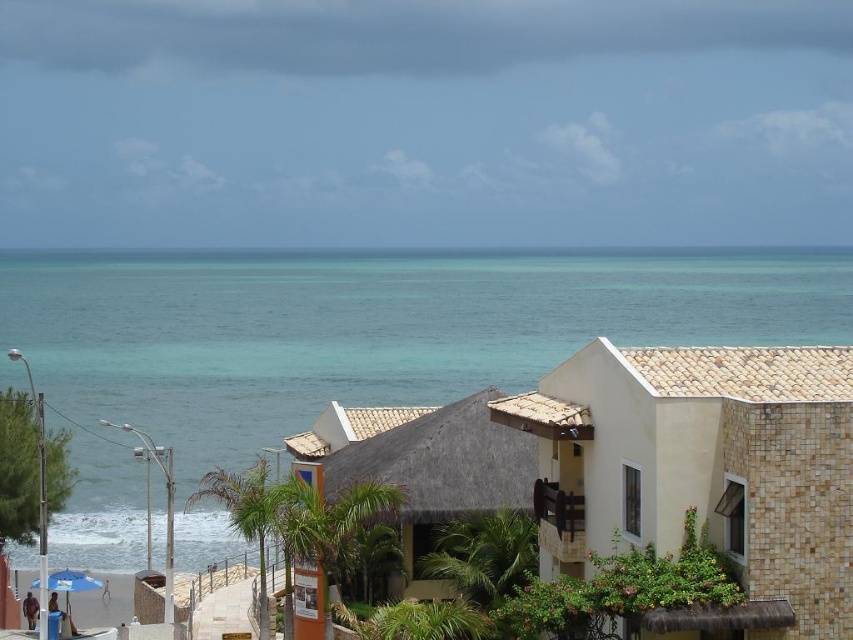
Consider the image. You are standing on a wooden deck that is 10 feet away from the turquoise water at center. If you want to reach the water, how many steps would you need to take if each step covers about 2 feet?

The distance between you and the turquoise water at center is 142.05 feet. Since each step covers 2 feet, you would need to take approximately 71 steps to reach the water.

You are planning to take a photo of both the turquoise water at center and the thatched roof hut at center. Since you want both to be clearly visible in the frame, which object should you focus on first to ensure proper focus?

You should focus on the thatched roof hut at center first because it is smaller in size than the turquoise water at center, making it easier to capture in focus.

You are standing on the beach and see the turquoise water at center and the beige tile house at right. Which object is closer to you?

The turquoise water at center is closer to you because it is positioned over the beige tile house at right, indicating it is in the foreground.